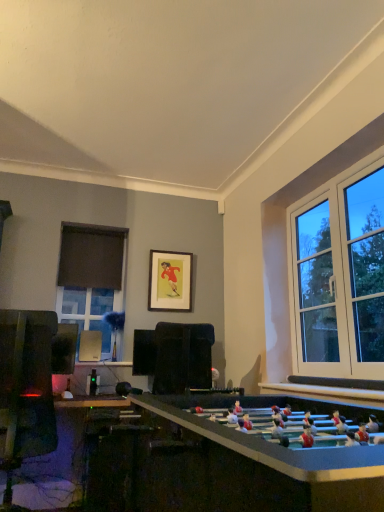
Question: In terms of size, does wooden framed picture at center appear bigger or smaller than black fabric curtain at left?

Choices:
 (A) big
 (B) small

Answer: (B)

Question: Is wooden framed picture at center in front of or behind black fabric curtain at left in the image?

Choices:
 (A) front
 (B) behind

Answer: (A)

Question: Which is farther from the black fabric curtain at left?

Choices:
 (A) wooden framed picture at center
 (B) matte glass window at left

Answer: (A)

Question: Considering the real-world distances, which object is farthest from the wooden framed picture at center?

Choices:
 (A) black fabric curtain at left
 (B) matte glass window at left

Answer: (B)